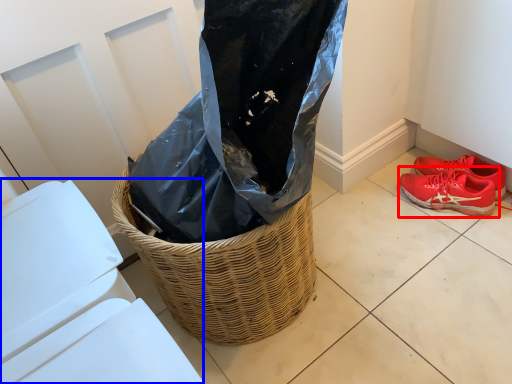
Question: Which object is closer to the camera taking this photo, footwear (highlighted by a red box) or lift (highlighted by a blue box)?

Choices:
 (A) footwear
 (B) lift

Answer: (B)